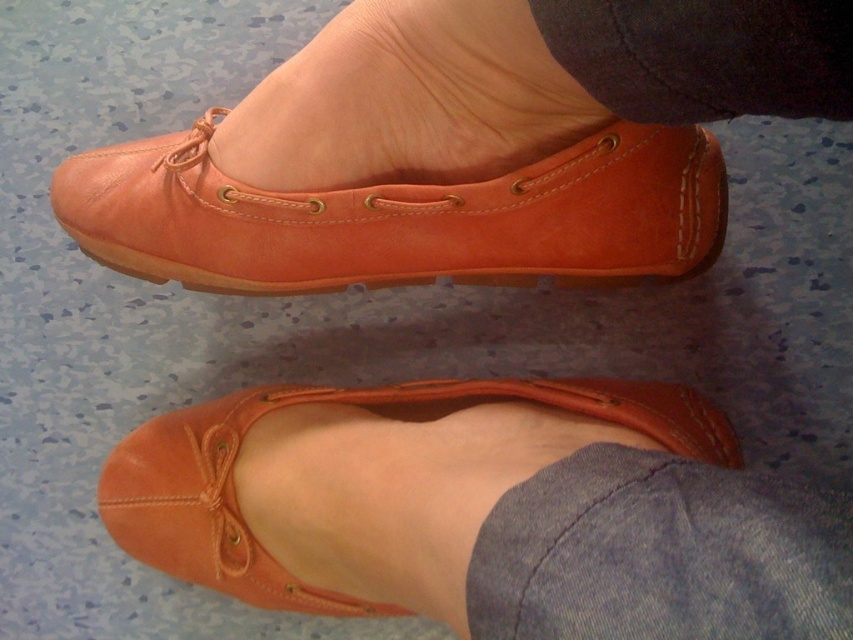
Is matte leather shoe at upper center taller than matte leather shoe at center?

Incorrect, matte leather shoe at upper center's height is not larger of matte leather shoe at center's.

Which is behind, point (344, 161) or point (157, 467)?

Point (157, 467)

Between point (712, 173) and point (239, 548), which one is positioned behind?

Positioned behind is point (239, 548).

Locate an element on the screen. matte leather shoe at upper center is located at coordinates (399, 188).